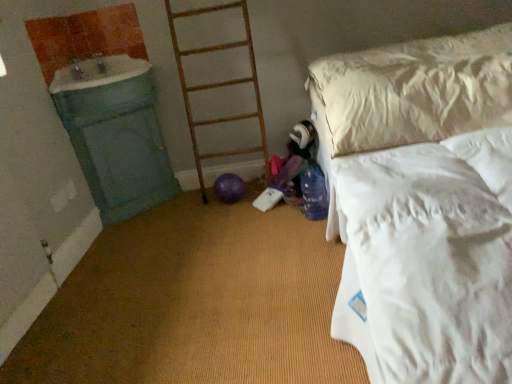
Question: From the image's perspective, relative to green painted wood sink at left, is white soft bed at right above or below?

Choices:
 (A) below
 (B) above

Answer: (A)

Question: Choose the correct answer: Is white soft bed at right inside green painted wood sink at left or outside it?

Choices:
 (A) inside
 (B) outside

Answer: (B)

Question: Which object is positioned closest to the wooden ladder at center?

Choices:
 (A) green painted wood sink at left
 (B) white soft bed at right

Answer: (A)

Question: Which object is the farthest from the white soft bed at right?

Choices:
 (A) green painted wood sink at left
 (B) wooden ladder at center

Answer: (A)